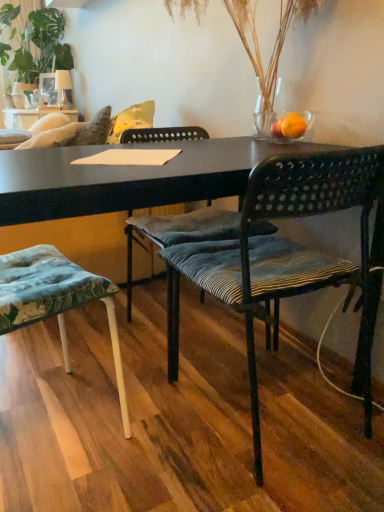
Question: Is orange matte glass at upper right inside textured fabric cushion at lower left, which is the 1th chair from left to right?

Choices:
 (A) no
 (B) yes

Answer: (A)

Question: Does textured fabric cushion at lower left, which is the 1th chair from left to right, lie behind orange matte glass at upper right?

Choices:
 (A) no
 (B) yes

Answer: (A)

Question: Can you confirm if textured fabric cushion at lower left, acting as the third chair starting from the right, is bigger than orange matte glass at upper right?

Choices:
 (A) no
 (B) yes

Answer: (B)

Question: From a real-world perspective, is textured fabric cushion at lower left, acting as the third chair starting from the right, physically below orange matte glass at upper right?

Choices:
 (A) no
 (B) yes

Answer: (B)

Question: Is textured fabric cushion at lower left, acting as the third chair starting from the right, not close to orange matte glass at upper right?

Choices:
 (A) no
 (B) yes

Answer: (A)

Question: Does textured fabric cushion at lower left, acting as the third chair starting from the right, have a smaller size compared to orange matte glass at upper right?

Choices:
 (A) no
 (B) yes

Answer: (A)

Question: From the image's perspective, would you say green leafy plant at upper left is positioned over black woven chair at center, acting as the 3th chair starting from the left?

Choices:
 (A) no
 (B) yes

Answer: (B)

Question: Is green leafy plant at upper left shorter than black woven chair at center, the 1th chair when ordered from right to left?

Choices:
 (A) no
 (B) yes

Answer: (A)

Question: Can you confirm if green leafy plant at upper left is wider than black woven chair at center, the 1th chair when ordered from right to left?

Choices:
 (A) yes
 (B) no

Answer: (A)

Question: Is the depth of green leafy plant at upper left greater than that of black woven chair at center, acting as the 3th chair starting from the left?

Choices:
 (A) no
 (B) yes

Answer: (B)

Question: Considering the relative sizes of green leafy plant at upper left and black woven chair at center, the 1th chair when ordered from right to left, in the image provided, is green leafy plant at upper left thinner than black woven chair at center, the 1th chair when ordered from right to left,?

Choices:
 (A) no
 (B) yes

Answer: (A)

Question: Is green leafy plant at upper left bigger than black woven chair at center, the 1th chair when ordered from right to left?

Choices:
 (A) no
 (B) yes

Answer: (B)

Question: Is black woven chair at center, the 1th chair when ordered from right to left, positioned before textured fabric cushion at lower left, acting as the third chair starting from the right?

Choices:
 (A) yes
 (B) no

Answer: (A)